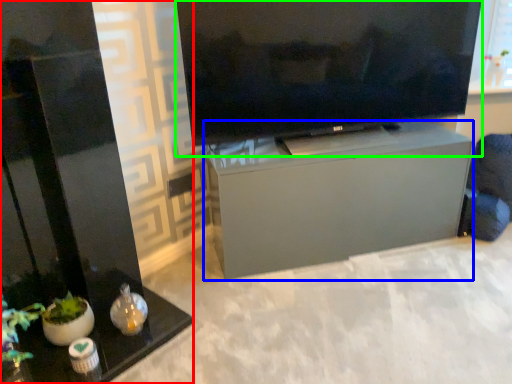
Question: Which object is positioned farthest from furniture (highlighted by a red box)? Select from furniture (highlighted by a blue box) and television (highlighted by a green box).

Choices:
 (A) furniture
 (B) television

Answer: (B)